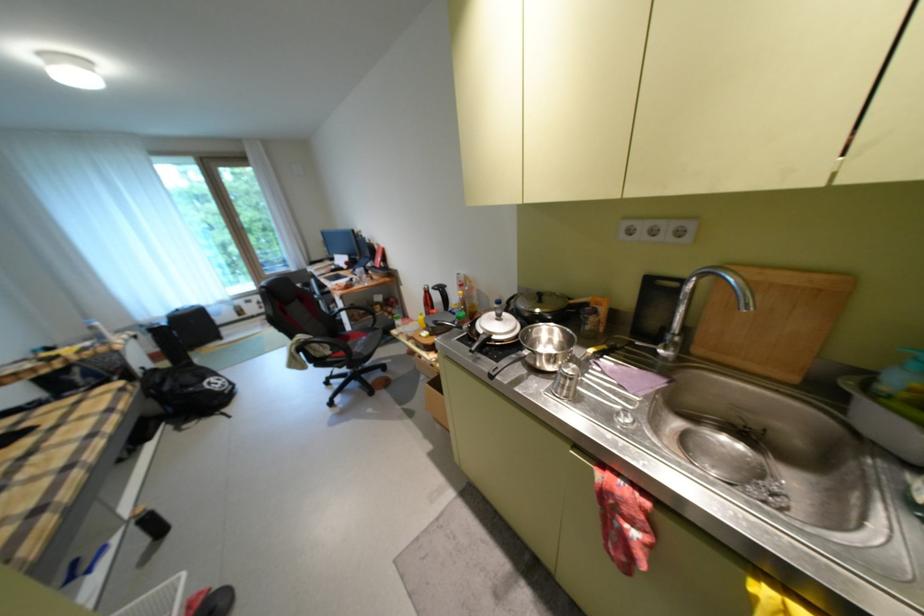
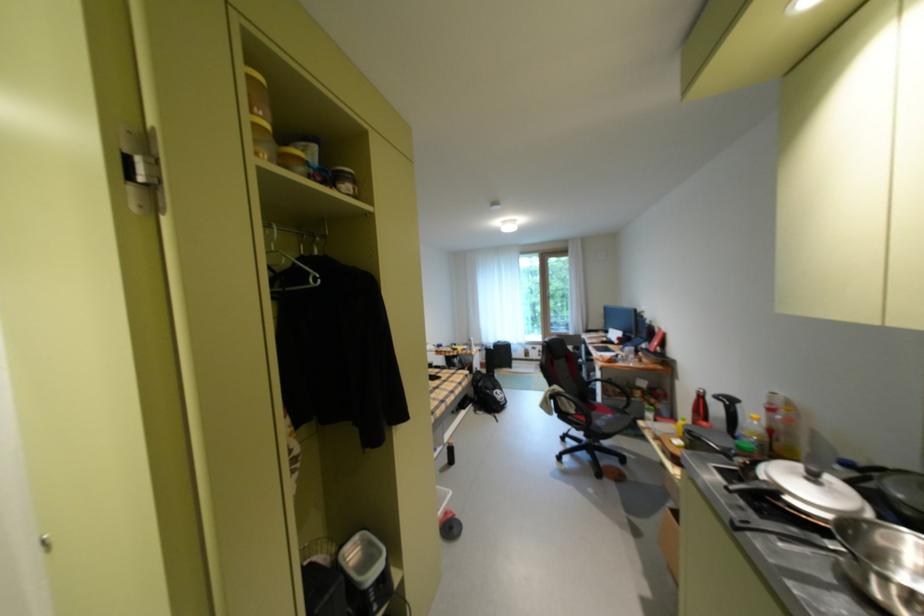
Question: Based on the continuous images, in which direction is the camera rotating? Reply with the corresponding letter.

Choices:
 (A) Left
 (B) Right
 (C) Up
 (D) Down

Answer: (A)